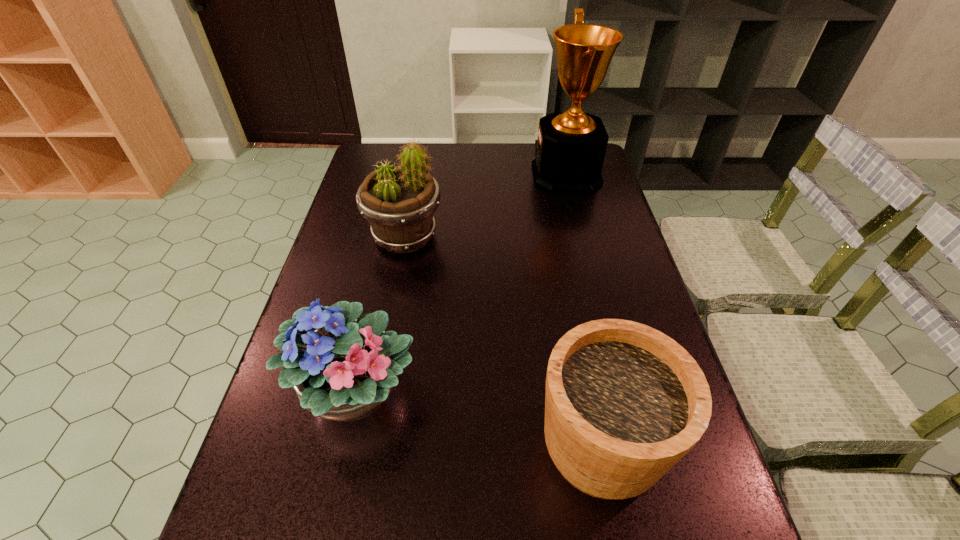
This screenshot has height=540, width=960. Find the location of `vacant area situated 0.220m on the back of the third nearest object`. vacant area situated 0.220m on the back of the third nearest object is located at coordinates (417, 176).

Locate an element on the screen. The width and height of the screenshot is (960, 540). free space located 0.400m on the left of the right flowerpot is located at coordinates (335, 445).

Where is `free point located on the back of the bouquet`? This screenshot has width=960, height=540. free point located on the back of the bouquet is located at coordinates [372, 318].

Locate an element on the screen. object that is at the far edge is located at coordinates (570, 149).

At what (x,y) coordinates should I click in order to perform the action: click on flowerpot that is at the left edge. Please return your answer as a coordinate pair (x, y). This screenshot has height=540, width=960. Looking at the image, I should click on (399, 202).

Where is `bouquet at the left edge`? bouquet at the left edge is located at coordinates (343, 371).

You are a GUI agent. You are given a task and a screenshot of the screen. Output one action in this format:
    pyautogui.click(x=<x>, y=<y>)
    Task: Click on the trophy cup situated at the right edge
    
    Given the screenshot: What is the action you would take?
    [x=570, y=149]

Locate an element on the screen. This screenshot has height=540, width=960. flowerpot that is positioned at the right edge is located at coordinates (624, 402).

Where is `object situated at the far right corner`? The image size is (960, 540). object situated at the far right corner is located at coordinates (570, 149).

Locate an element on the screen. The height and width of the screenshot is (540, 960). vacant space at the far edge of the desktop is located at coordinates (481, 161).